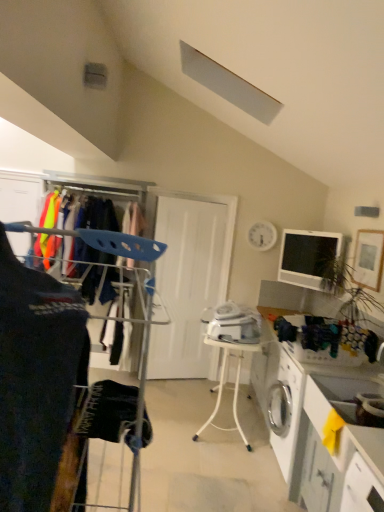
Question: Is point [66, 358] positioned closer to the camera than point [235, 317]?

Choices:
 (A) farther
 (B) closer

Answer: (B)

Question: From their relative heights in the image, would you say dark blue fabric at left is taller or shorter than white plastic iron at center?

Choices:
 (A) short
 (B) tall

Answer: (B)

Question: Estimate the real-world distances between objects in this image. Which object is closer to the white glossy counter at lower right, marked as the second counter in a front-to-back arrangement?

Choices:
 (A) dark blue fabric at left
 (B) matte black monitor at upper right
 (C) white plastic table at center
 (D) white plastic iron at center
 (E) white matte door at center

Answer: (C)

Question: Which object is the closest to the white plastic iron at center?

Choices:
 (A) matte black monitor at upper right
 (B) white matte door at center
 (C) white glossy counter at lower right, the 2th counter in the back-to-front sequence
 (D) white glossy counter at lower right, marked as the second counter in a front-to-back arrangement
 (E) white plastic table at center

Answer: (E)